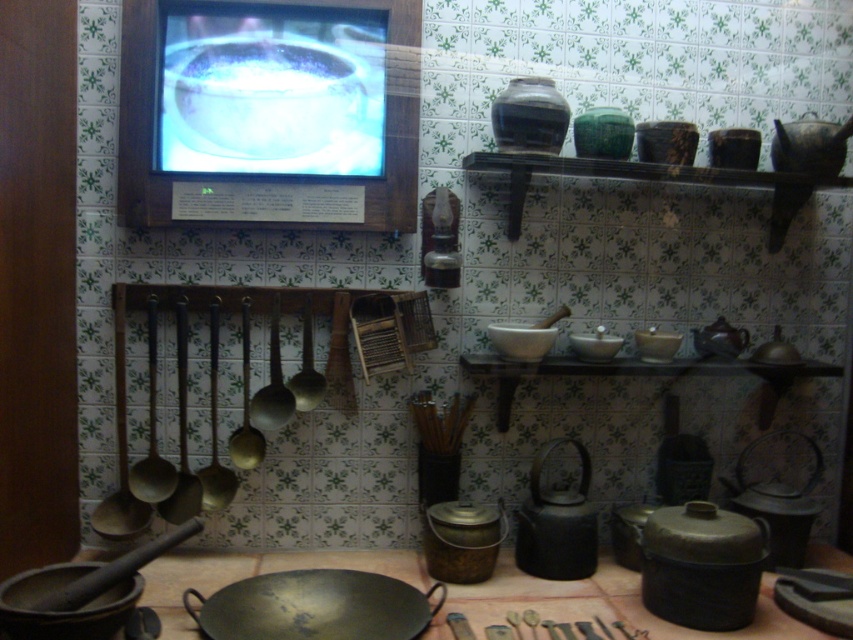
Question: Is matte black kettle at center below brown matte tea pot at right?

Choices:
 (A) no
 (B) yes

Answer: (B)

Question: Which of the following is the closest to the observer?

Choices:
 (A) brass/bronze frying pan at center
 (B) brown matte tea pot at right
 (C) dark brown wood at lower center

Answer: (C)

Question: Does brass/bronze frying pan at center appear on the left side of brown matte tea pot at right?

Choices:
 (A) no
 (B) yes

Answer: (B)

Question: Does matte black kettle at center have a greater width compared to brown matte tea pot at right?

Choices:
 (A) no
 (B) yes

Answer: (B)

Question: Which object is the closest to the dark brown wood at lower center?

Choices:
 (A) brass/bronze frying pan at center
 (B) brown matte tea pot at right

Answer: (A)

Question: Which object is farther from the camera taking this photo?

Choices:
 (A) shiny silver tea pot at center
 (B) dark brown wood at lower center
 (C) dark gray matte frying pan at lower left

Answer: (A)